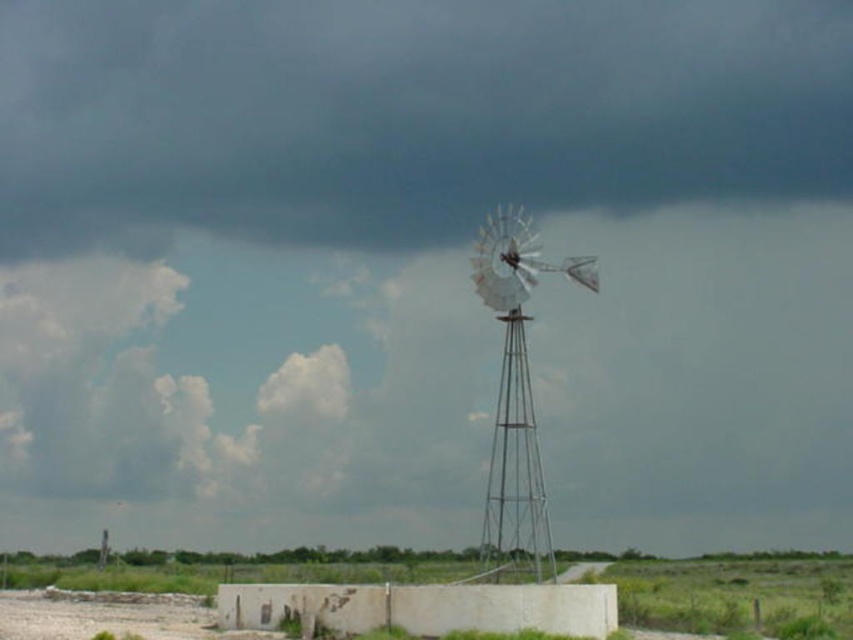
Question: Among these points, which one is nearest to the camera?

Choices:
 (A) (515, 417)
 (B) (675, 282)

Answer: (A)

Question: Is cloudy sky at upper center bigger than metallic silver windmill at center?

Choices:
 (A) no
 (B) yes

Answer: (B)

Question: Which point appears closest to the camera in this image?

Choices:
 (A) (505, 557)
 (B) (602, 280)

Answer: (A)

Question: Can you confirm if cloudy sky at upper center is thinner than metallic silver windmill at center?

Choices:
 (A) yes
 (B) no

Answer: (B)

Question: Does cloudy sky at upper center appear on the left side of metallic silver windmill at center?

Choices:
 (A) yes
 (B) no

Answer: (A)